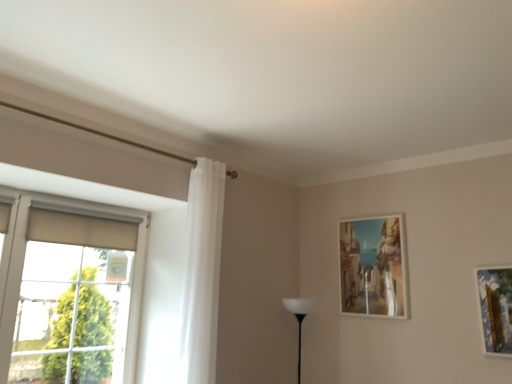
Question: From the image's perspective, would you say white matte table lamp at center is shown under matte wooden picture frame at upper right?

Choices:
 (A) no
 (B) yes

Answer: (B)

Question: Are white matte table lamp at center and matte wooden picture frame at upper right located far from each other?

Choices:
 (A) no
 (B) yes

Answer: (A)

Question: Is white matte table lamp at center turned away from matte wooden picture frame at upper right?

Choices:
 (A) no
 (B) yes

Answer: (A)

Question: From a real-world perspective, is white matte table lamp at center positioned over matte wooden picture frame at upper right based on gravity?

Choices:
 (A) yes
 (B) no

Answer: (B)

Question: Is white matte table lamp at center shorter than matte wooden picture frame at upper right?

Choices:
 (A) no
 (B) yes

Answer: (B)

Question: Is white matte table lamp at center beside matte wooden picture frame at upper right?

Choices:
 (A) yes
 (B) no

Answer: (B)

Question: Is white sheer curtain at left turned away from white matte table lamp at center?

Choices:
 (A) yes
 (B) no

Answer: (B)

Question: Are white sheer curtain at left and white matte table lamp at center making contact?

Choices:
 (A) no
 (B) yes

Answer: (A)

Question: From the image's perspective, is white sheer curtain at left under white matte table lamp at center?

Choices:
 (A) no
 (B) yes

Answer: (A)

Question: Is white sheer curtain at left to the right of white matte table lamp at center from the viewer's perspective?

Choices:
 (A) no
 (B) yes

Answer: (A)

Question: From a real-world perspective, is white sheer curtain at left located beneath white matte table lamp at center?

Choices:
 (A) yes
 (B) no

Answer: (B)

Question: From the image's perspective, is white sheer curtain at left located above white matte table lamp at center?

Choices:
 (A) no
 (B) yes

Answer: (B)

Question: Is matte wooden picture frame at upper right in contact with white sheer curtain at left?

Choices:
 (A) no
 (B) yes

Answer: (A)